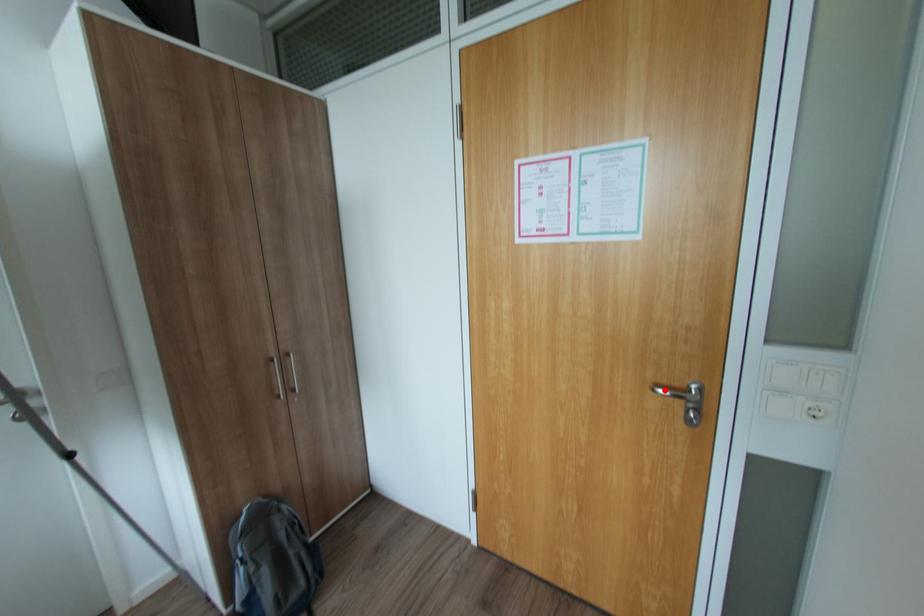
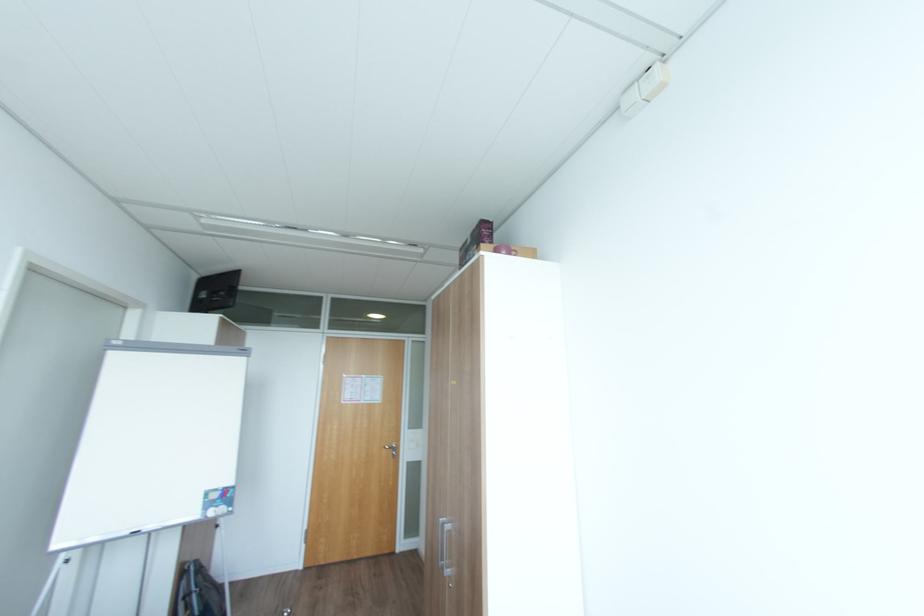
In the second image, find the point that corresponds to the highlighted location in the first image.

(392, 448)